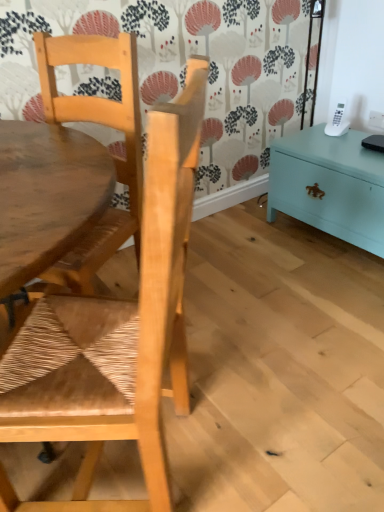
Question: Can you confirm if natural wood chair at upper left, the first chair when ordered from top to bottom, is taller than white plastic power outlet at upper right?

Choices:
 (A) no
 (B) yes

Answer: (B)

Question: Is natural wood chair at upper left, the second chair positioned from the bottom, facing away from white plastic power outlet at upper right?

Choices:
 (A) yes
 (B) no

Answer: (B)

Question: From the image's perspective, is natural wood chair at upper left, the second chair positioned from the bottom, located above white plastic power outlet at upper right?

Choices:
 (A) yes
 (B) no

Answer: (B)

Question: Considering the relative positions of natural wood chair at upper left, the first chair when ordered from top to bottom, and white plastic power outlet at upper right in the image provided, is natural wood chair at upper left, the first chair when ordered from top to bottom, in front of white plastic power outlet at upper right?

Choices:
 (A) no
 (B) yes

Answer: (B)

Question: Is white plastic power outlet at upper right a part of natural wood chair at upper left, the second chair positioned from the bottom?

Choices:
 (A) no
 (B) yes

Answer: (A)

Question: Is natural wood chair at left, the 1th chair ordered from the bottom, wider or thinner than natural wood chair at upper left, the first chair when ordered from top to bottom?

Choices:
 (A) thin
 (B) wide

Answer: (B)

Question: From the image's perspective, relative to natural wood chair at upper left, the first chair when ordered from top to bottom, is natural wood chair at left, the 1th chair ordered from the bottom, above or below?

Choices:
 (A) above
 (B) below

Answer: (B)

Question: In the image, is natural wood chair at left, positioned as the 2th chair in top-to-bottom order, positioned in front of or behind natural wood chair at upper left, the first chair when ordered from top to bottom?

Choices:
 (A) behind
 (B) front

Answer: (B)

Question: Choose the correct answer: Is natural wood chair at left, the 1th chair ordered from the bottom, inside natural wood chair at upper left, the first chair when ordered from top to bottom, or outside it?

Choices:
 (A) outside
 (B) inside

Answer: (A)

Question: Based on their positions, is white plastic power outlet at upper right located to the left or right of natural wood chair at left, positioned as the 2th chair in top-to-bottom order?

Choices:
 (A) right
 (B) left

Answer: (A)

Question: Does point (382, 128) appear closer or farther from the camera than point (97, 347)?

Choices:
 (A) farther
 (B) closer

Answer: (A)

Question: Is white plastic power outlet at upper right spatially inside natural wood chair at left, the 1th chair ordered from the bottom, or outside of it?

Choices:
 (A) inside
 (B) outside

Answer: (B)

Question: In terms of width, does white plastic power outlet at upper right look wider or thinner when compared to natural wood chair at left, the 1th chair ordered from the bottom?

Choices:
 (A) wide
 (B) thin

Answer: (B)

Question: From a real-world perspective, is white plastic power outlet at upper right physically located above or below teal painted wood chest at right?

Choices:
 (A) above
 (B) below

Answer: (A)

Question: Considering the positions of point (370, 128) and point (327, 148), is point (370, 128) closer or farther from the camera than point (327, 148)?

Choices:
 (A) closer
 (B) farther

Answer: (B)